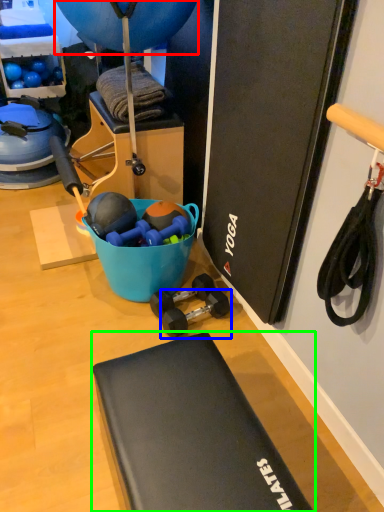
Question: Which is farther away from balloon (highlighted by a red box)? dumbbell (highlighted by a blue box) or furniture (highlighted by a green box)?

Choices:
 (A) dumbbell
 (B) furniture

Answer: (B)